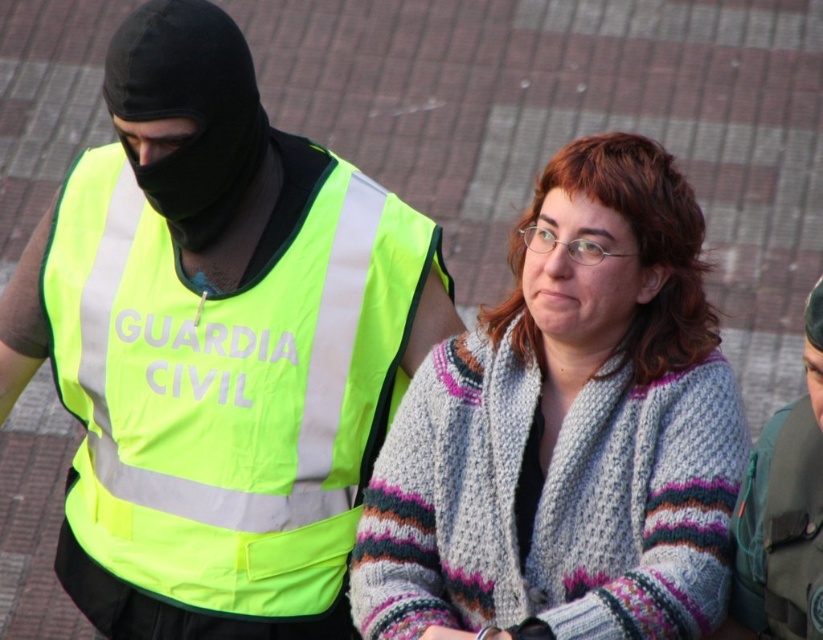
Based on the photo, you are a fashion designer observing the scene. You notice the neon yellow reflective vest at center and the knitted sweater at center. Which clothing item is positioned higher on the body?

The neon yellow reflective vest at center is above the knitted sweater at center, so the neon yellow reflective vest at center is positioned higher on the body.

You are a photographer trying to capture a clear shot of both the neon yellow reflective vest at center and the knitted sweater at center. Which object should you focus on first to ensure it appears sharp in the photo?

You should focus on the neon yellow reflective vest at center first because it is closer to you than the knitted sweater at center, ensuring it will be sharp while the sweater may appear slightly blurred due to depth of field.

You are a tailor measuring garments for a customer. You have two items in front of you, the neon yellow reflective vest at center and the knitted sweater at center. Which garment has a greater width?

The knitted sweater at center has a greater width than the neon yellow reflective vest at center according to the description.